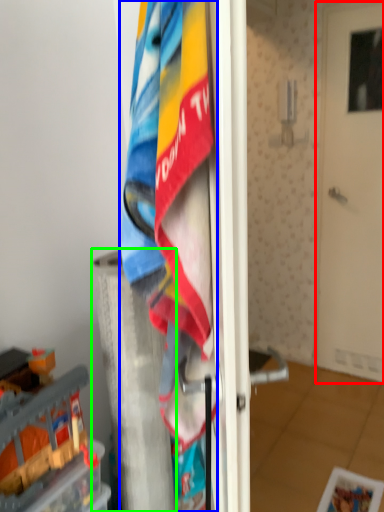
Question: Which object is the farthest from door (highlighted by a red box)? Choose among these: towel (highlighted by a blue box) or pillar (highlighted by a green box).

Choices:
 (A) towel
 (B) pillar

Answer: (A)